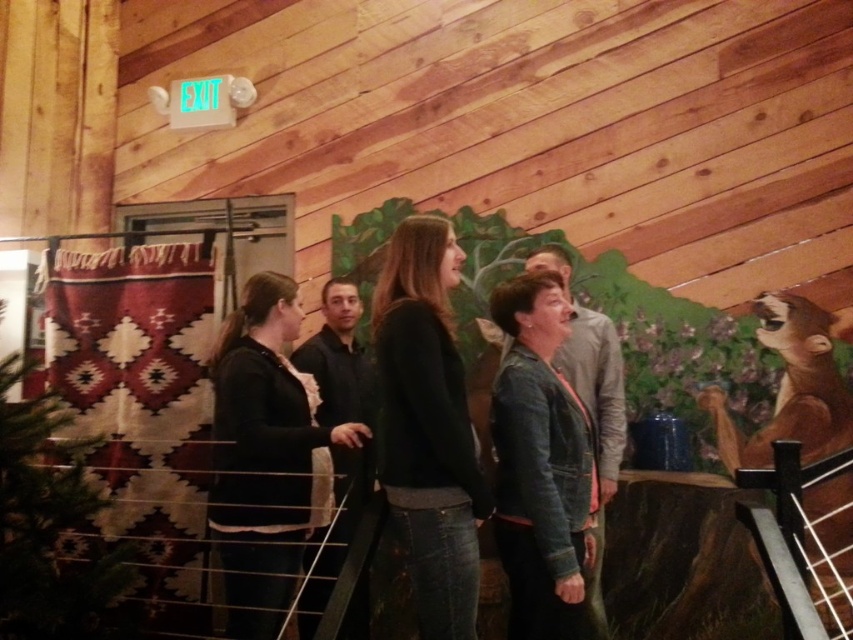
Is point (262, 522) less distant than point (595, 508)?

No, (262, 522) is further to viewer.

This screenshot has height=640, width=853. What are the coordinates of `black matte jacket at center` in the screenshot? It's located at (265, 456).

Can you confirm if black matte jacket at center is smaller than brown furry bear at right?

No, black matte jacket at center is not smaller than brown furry bear at right.

Is point (239, 371) farther from viewer compared to point (848, 413)?

No, it is in front of (848, 413).

You are a GUI agent. You are given a task and a screenshot of the screen. Output one action in this format:
    pyautogui.click(x=<x>, y=<y>)
    Task: Click on the black matte jacket at center
    The height and width of the screenshot is (640, 853).
    Given the screenshot: What is the action you would take?
    pyautogui.click(x=265, y=456)

Where is `black matte jacket at center`? The height and width of the screenshot is (640, 853). black matte jacket at center is located at coordinates (265, 456).

Is point (55, 326) farther from camera compared to point (808, 513)?

Yes.

Does point (138, 323) come farther from viewer compared to point (840, 387)?

Yes, it is.

In order to click on red and white woven quilt at left in this screenshot , I will do `click(142, 406)`.